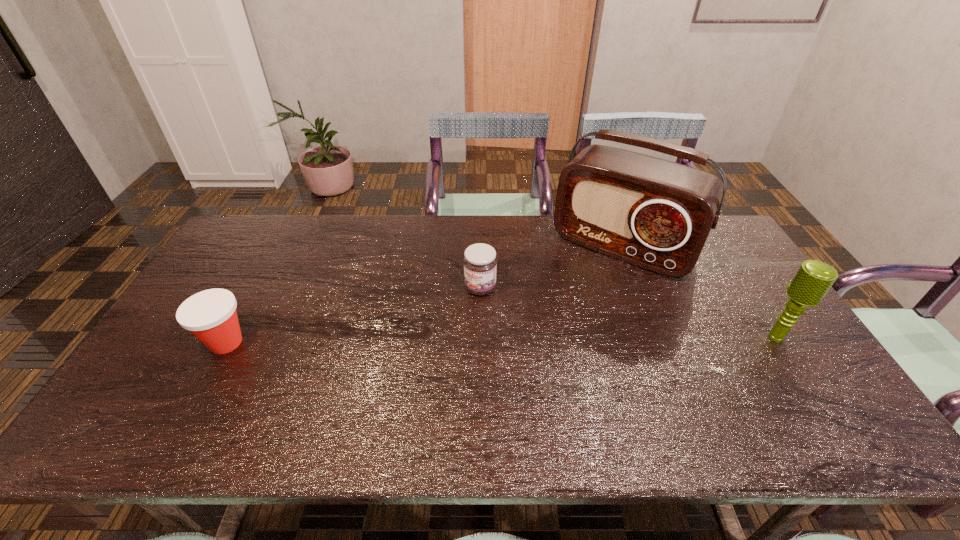
Identify the location of empty space that is in between the second object from left to right and the second object from right to left. point(552,267).

I want to click on free point between the jam and the second object from right to left, so click(x=552, y=267).

Identify the location of free space that is in between the second object from right to left and the jam. Image resolution: width=960 pixels, height=540 pixels. (552, 267).

Locate an element on the screen. vacant space in between the radio receiver and the leftmost object is located at coordinates (424, 295).

Where is `object that stands as the third closest to the leftmost object`? object that stands as the third closest to the leftmost object is located at coordinates (813, 279).

Find the location of `the closest object to the rightmost object`. the closest object to the rightmost object is located at coordinates (656, 214).

The image size is (960, 540). What are the coordinates of `vacant space that satisfies the following two spatial constraints: 1. on the back side of the third object from right to left; 2. on the right side of the third object from left to right` in the screenshot? It's located at (480, 247).